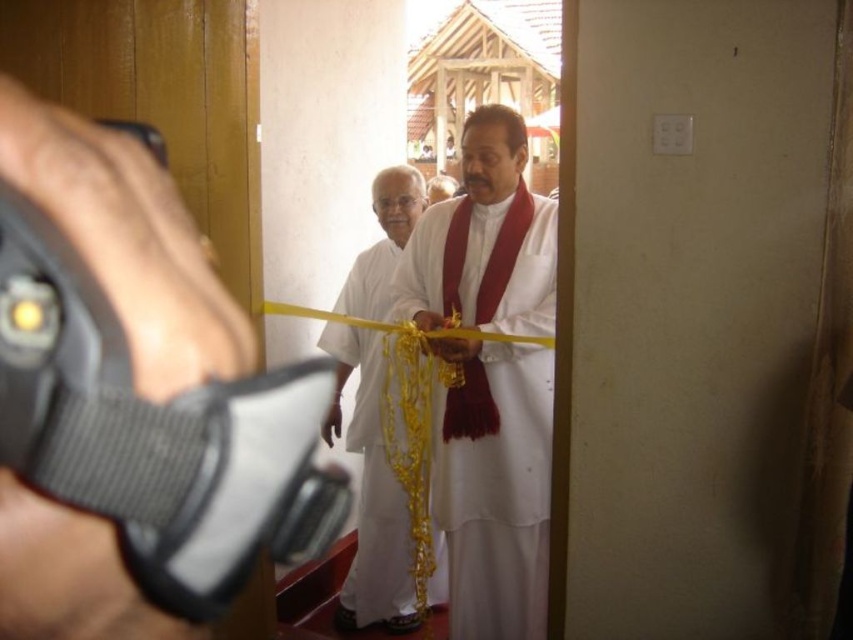
Between white silk dhoti at center and white silk cloth at center, which one has more height?

With more height is white silk cloth at center.

Does white silk dhoti at center have a larger size compared to white silk cloth at center?

No.

The image size is (853, 640). What are the coordinates of `white silk dhoti at center` in the screenshot? It's located at (494, 486).

I want to click on white silk dhoti at center, so click(x=494, y=486).